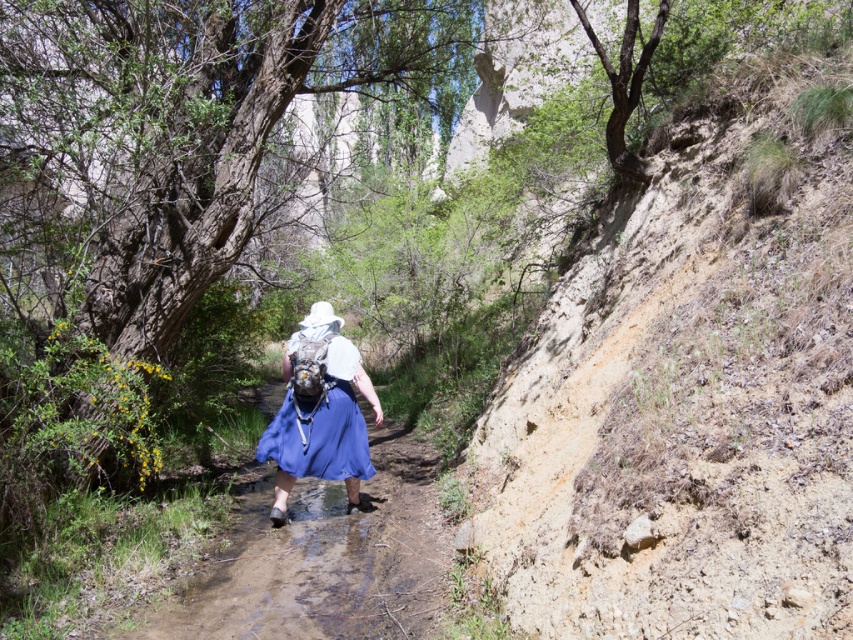
You are a hiker standing at the starting point of the path. You see two points marked on the path ahead of you. Which point is closer to you, point [186,563] or point [339,436]?

Point [186,563] is closer to you than point [339,436].

You are a photographer capturing the scene of a person hiking on a muddy path. You notice the blue fabric skirt at center and the blue satin dress at center. Which clothing item is closer to the camera?

The blue fabric skirt at center is positioned under the blue satin dress at center, so the blue satin dress at center is closer to the camera.